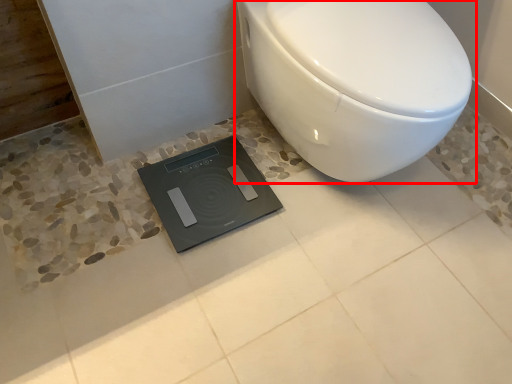
Question: From the image's perspective, where is toilet (annotated by the red box) located relative to scale?

Choices:
 (A) above
 (B) below

Answer: (A)